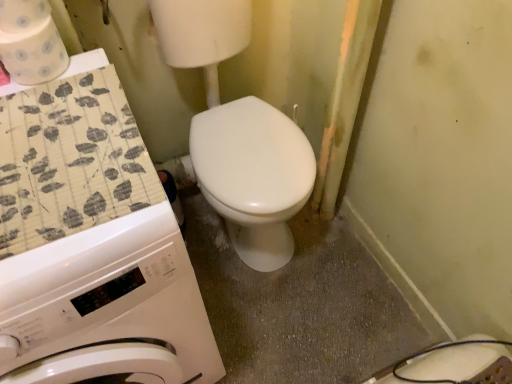
Question: Is white paper towel at upper left, the 2th toilet paper in the bottom-to-top sequence, positioned far away from white glossy washing machine at left?

Choices:
 (A) yes
 (B) no

Answer: (B)

Question: Is white paper towel at upper left, the 2th toilet paper in the bottom-to-top sequence, at the right side of white glossy washing machine at left?

Choices:
 (A) yes
 (B) no

Answer: (A)

Question: Does white paper towel at upper left, placed as the 1th toilet paper when sorted from top to bottom, have a lesser height compared to white glossy washing machine at left?

Choices:
 (A) yes
 (B) no

Answer: (A)

Question: Can you confirm if white paper towel at upper left, the 2th toilet paper in the bottom-to-top sequence, is taller than white glossy washing machine at left?

Choices:
 (A) no
 (B) yes

Answer: (A)

Question: Does white paper towel at upper left, the 2th toilet paper in the bottom-to-top sequence, lie in front of white glossy washing machine at left?

Choices:
 (A) no
 (B) yes

Answer: (A)

Question: Is point (22, 84) positioned closer to the camera than point (90, 354)?

Choices:
 (A) closer
 (B) farther

Answer: (B)

Question: In the image, is patterned paper towel at upper left, acting as the first toilet paper starting from the bottom, on the left side or the right side of white glossy washing machine at left?

Choices:
 (A) left
 (B) right

Answer: (B)

Question: Looking at their shapes, would you say patterned paper towel at upper left, acting as the first toilet paper starting from the bottom, is wider or thinner than white glossy washing machine at left?

Choices:
 (A) wide
 (B) thin

Answer: (B)

Question: Based on their sizes in the image, would you say patterned paper towel at upper left, which is the second toilet paper in top-to-bottom order, is bigger or smaller than white glossy washing machine at left?

Choices:
 (A) small
 (B) big

Answer: (A)

Question: Based on their sizes in the image, would you say patterned paper towel at upper left, which is the second toilet paper in top-to-bottom order, is bigger or smaller than white paper towel at upper left, the 2th toilet paper in the bottom-to-top sequence?

Choices:
 (A) big
 (B) small

Answer: (A)

Question: Would you say patterned paper towel at upper left, acting as the first toilet paper starting from the bottom, is inside or outside white paper towel at upper left, placed as the 1th toilet paper when sorted from top to bottom?

Choices:
 (A) outside
 (B) inside

Answer: (A)

Question: Would you say patterned paper towel at upper left, which is the second toilet paper in top-to-bottom order, is to the left or to the right of white paper towel at upper left, the 2th toilet paper in the bottom-to-top sequence, in the picture?

Choices:
 (A) left
 (B) right

Answer: (B)

Question: In terms of width, does patterned paper towel at upper left, which is the second toilet paper in top-to-bottom order, look wider or thinner when compared to white paper towel at upper left, placed as the 1th toilet paper when sorted from top to bottom?

Choices:
 (A) thin
 (B) wide

Answer: (B)

Question: From the image's perspective, is white paper towel at upper left, the 2th toilet paper in the bottom-to-top sequence, positioned above or below patterned paper towel at upper left, which is the second toilet paper in top-to-bottom order?

Choices:
 (A) below
 (B) above

Answer: (B)

Question: Considering their positions, is white paper towel at upper left, placed as the 1th toilet paper when sorted from top to bottom, located in front of or behind patterned paper towel at upper left, which is the second toilet paper in top-to-bottom order?

Choices:
 (A) behind
 (B) front

Answer: (B)